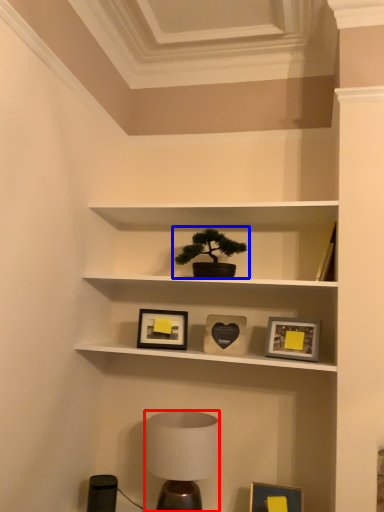
Question: Which point is further to the camera, table lamp (highlighted by a red box) or houseplant (highlighted by a blue box)?

Choices:
 (A) table lamp
 (B) houseplant

Answer: (B)